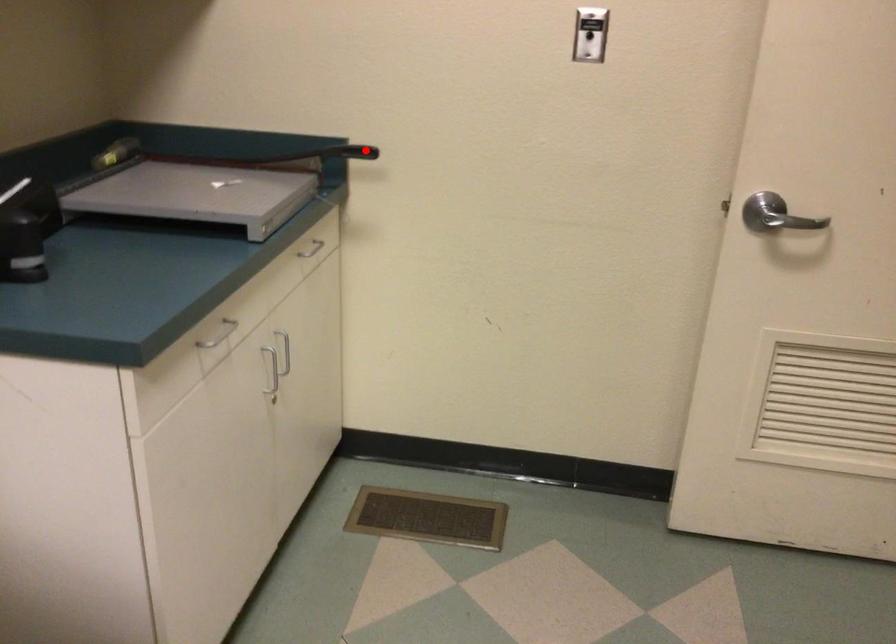
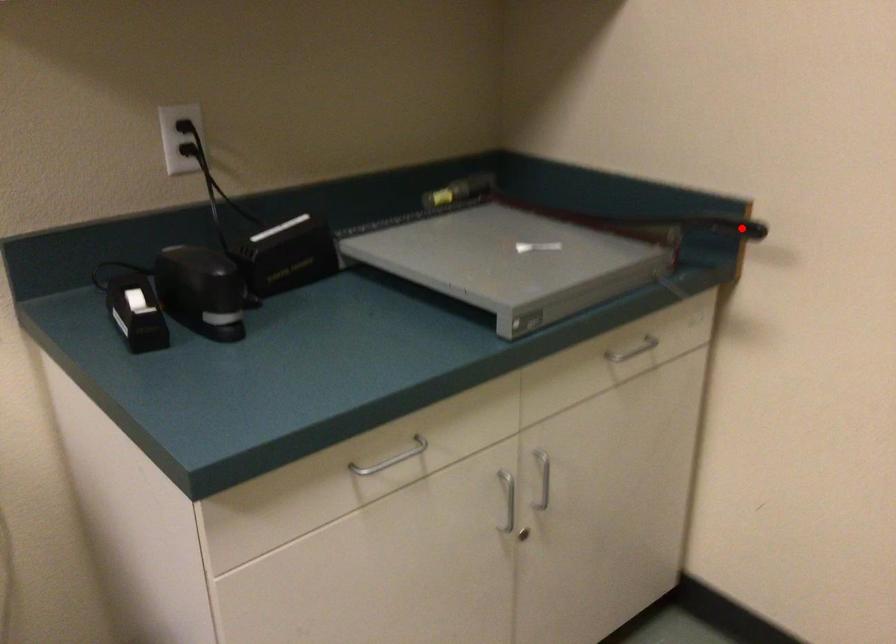
I am providing you with two images of the same scene from different viewpoints. A red point is marked on the first image and another point is marked on the second image. Is the red point in image1 aligned with the point shown in image2?

Yes